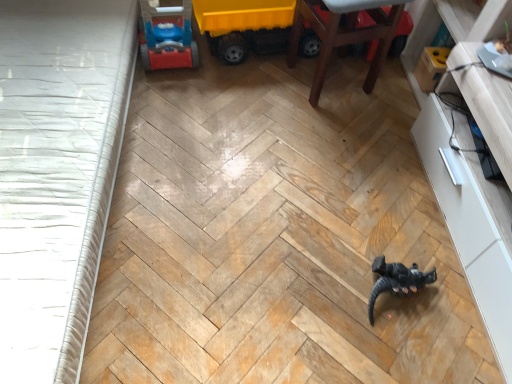
This screenshot has height=384, width=512. What are the coordinates of `free space in front of yellow plastic toy truck at upper center, which is the 1th toy from left to right` in the screenshot? It's located at pos(252,100).